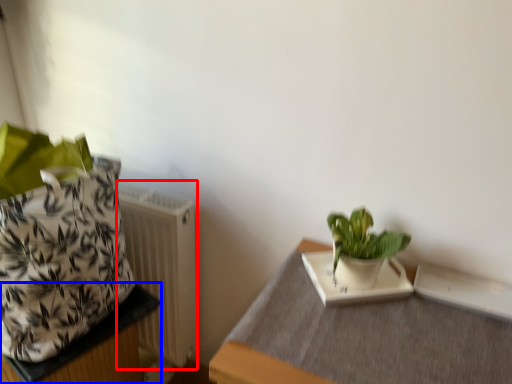
Question: Which object is further to the camera taking this photo, radiator (highlighted by a red box) or table (highlighted by a blue box)?

Choices:
 (A) radiator
 (B) table

Answer: (A)